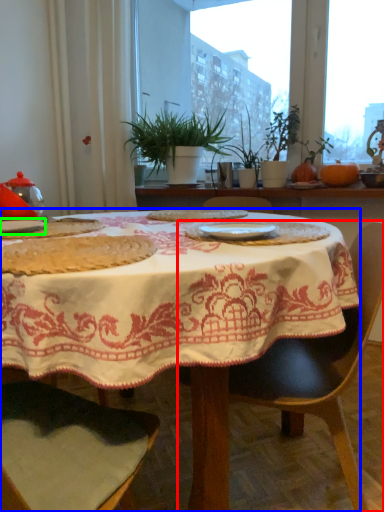
Question: Estimate the real-world distances between objects in this image. Which object is farther from chair (highlighted by a red box), table (highlighted by a blue box) or tableware (highlighted by a green box)?

Choices:
 (A) table
 (B) tableware

Answer: (B)